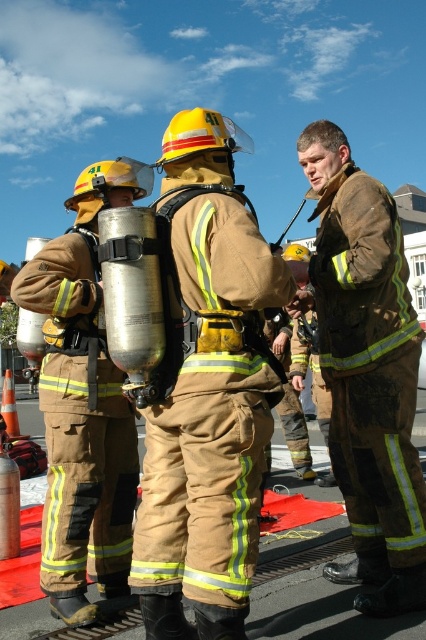
Can you confirm if brown leather jacket at center is bigger than matte black fireman at left?

No.

The height and width of the screenshot is (640, 426). Identify the location of brown leather jacket at center. (367, 371).

Does matte khaki uniform at center have a smaller size compared to brown leather jacket at center?

Indeed, matte khaki uniform at center has a smaller size compared to brown leather jacket at center.

Who is positioned more to the right, matte khaki uniform at center or brown leather jacket at center?

From the viewer's perspective, brown leather jacket at center appears more on the right side.

Between point (169, 544) and point (370, 540), which one is positioned behind?

The point (370, 540) is behind.

This screenshot has width=426, height=640. I want to click on matte khaki uniform at center, so click(x=206, y=388).

Does matte khaki uniform at center appear under matte black fireman at left?

No.

The height and width of the screenshot is (640, 426). Find the location of `matte khaki uniform at center`. matte khaki uniform at center is located at coordinates (206, 388).

The height and width of the screenshot is (640, 426). I want to click on matte khaki uniform at center, so click(x=206, y=388).

Locate an element on the screen. The image size is (426, 640). matte khaki uniform at center is located at coordinates (206, 388).